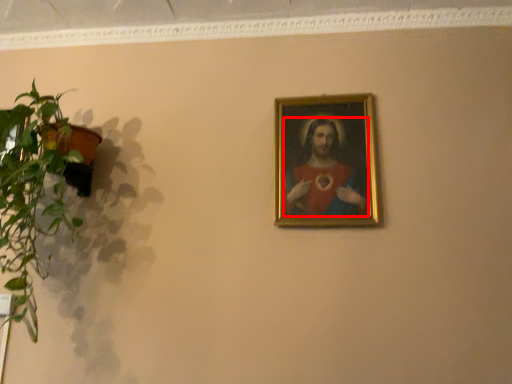
Question: In this image, where is person (annotated by the red box) located relative to houseplant?

Choices:
 (A) left
 (B) right

Answer: (B)